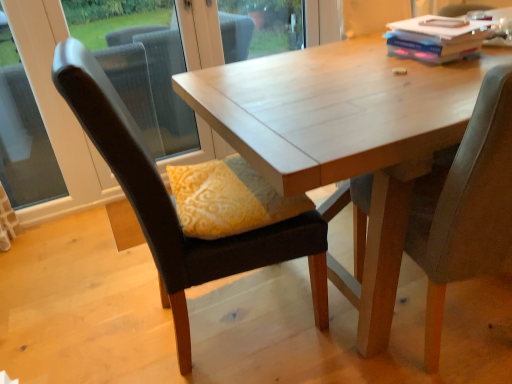
This screenshot has width=512, height=384. What do you see at coordinates (436, 38) in the screenshot? I see `hardcover book at upper right` at bounding box center [436, 38].

At what (x,y) coordinates should I click in order to perform the action: click on velvet dark brown chair at center, which appears as the second chair when viewed from the right. Please return your answer as a coordinate pair (x, y). The width and height of the screenshot is (512, 384). Looking at the image, I should click on (172, 204).

Measure the distance between yellow fabric pillow at center and camera.

A distance of 3.89 feet exists between yellow fabric pillow at center and camera.

What do you see at coordinates (114, 87) in the screenshot?
I see `white plastic window frame at upper left` at bounding box center [114, 87].

Image resolution: width=512 pixels, height=384 pixels. Find the location of `white plastic window frame at upper left`. white plastic window frame at upper left is located at coordinates (114, 87).

What is the approximate width of velvet grey chair at right, which ranks as the second chair in left-to-right order?

It is 23.10 inches.

At what (x,y) coordinates should I click in order to perform the action: click on hardcover book at upper right. Please return your answer as a coordinate pair (x, y). The height and width of the screenshot is (384, 512). Looking at the image, I should click on (436, 38).

From a real-world perspective, between white plastic window frame at upper left and velvet dark brown chair at center, placed as the 1th chair when sorted from left to right, who is vertically lower?

From a 3D spatial view, velvet dark brown chair at center, placed as the 1th chair when sorted from left to right, is below.

From the image's perspective, between white plastic window frame at upper left and velvet dark brown chair at center, which appears as the second chair when viewed from the right, which one is located above?

white plastic window frame at upper left appears higher in the image.

How different are the orientations of white plastic window frame at upper left and velvet dark brown chair at center, placed as the 1th chair when sorted from left to right, in degrees?

The facing directions of white plastic window frame at upper left and velvet dark brown chair at center, placed as the 1th chair when sorted from left to right, are 84.6 degrees apart.

Is white plastic window frame at upper left smaller than velvet dark brown chair at center, which appears as the second chair when viewed from the right?

Yes, white plastic window frame at upper left is smaller than velvet dark brown chair at center, which appears as the second chair when viewed from the right.

Would you say yellow fabric pillow at center is a long distance from transparent glass window at left?

Indeed, yellow fabric pillow at center is not near transparent glass window at left.

From the picture: Considering the relative sizes of yellow fabric pillow at center and transparent glass window at left in the image provided, is yellow fabric pillow at center smaller than transparent glass window at left?

Actually, yellow fabric pillow at center might be larger than transparent glass window at left.

Which of these two, hardcover book at upper right or yellow fabric pillow at center, stands taller?

yellow fabric pillow at center is taller.

Which is closer to the camera, (405, 39) or (287, 204)?

Point (405, 39) is farther from the camera than point (287, 204).

From the image's perspective, does hardcover book at upper right appear higher than yellow fabric pillow at center?

Yes.

From a real-world perspective, is hardcover book at upper right positioned above or below yellow fabric pillow at center?

From a real-world perspective, hardcover book at upper right is physically above yellow fabric pillow at center.

Which is behind, point (438, 51) or point (441, 73)?

The point (438, 51) is farther.

Which is in front, hardcover book at upper right or wooden table at center?

wooden table at center is in front.

Between hardcover book at upper right and wooden table at center, which one has smaller size?

With smaller size is hardcover book at upper right.

Can we say hardcover book at upper right lies outside wooden table at center?

No, hardcover book at upper right is inside wooden table at center's boundary.

Consider the image. Is transparent glass window at left outside of wooden table at center?

Yes, transparent glass window at left is outside of wooden table at center.

From the image's perspective, is transparent glass window at left located above wooden table at center?

Yes, from the image's perspective, transparent glass window at left is on top of wooden table at center.

Is transparent glass window at left far away from wooden table at center?

Indeed, transparent glass window at left is not near wooden table at center.

From a real-world perspective, is transparent glass window at left positioned over wooden table at center based on gravity?

Yes.

Is white plastic window frame at upper left inside yellow fabric pillow at center?

That's incorrect, white plastic window frame at upper left is not inside yellow fabric pillow at center.

From a real-world perspective, is yellow fabric pillow at center above or below white plastic window frame at upper left?

From a real-world perspective, yellow fabric pillow at center is physically below white plastic window frame at upper left.

Is yellow fabric pillow at center taller than white plastic window frame at upper left?

No.

Between transparent glass window at left and velvet grey chair at right, which ranks as the second chair in left-to-right order, which one appears on the right side from the viewer's perspective?

Positioned to the right is velvet grey chair at right, which ranks as the second chair in left-to-right order.

Is transparent glass window at left positioned behind velvet grey chair at right, the first chair from the right?

Yes, the depth of transparent glass window at left is greater than that of velvet grey chair at right, the first chair from the right.

From the image's perspective, which one is positioned higher, transparent glass window at left or velvet grey chair at right, which ranks as the second chair in left-to-right order?

transparent glass window at left.

What are the coordinates of `window behind the velvet grey chair at right, which ranks as the second chair in left-to-right order` in the screenshot? It's located at (23, 134).

Image resolution: width=512 pixels, height=384 pixels. I want to click on chair that is the 1st object to the right of the white plastic window frame at upper left, starting at the anchor, so click(x=172, y=204).

The width and height of the screenshot is (512, 384). Identify the location of pillow in front of the transparent glass window at left. (228, 199).

Which object lies further to the anchor point wooden table at center, yellow fabric pillow at center or velvet grey chair at right, the first chair from the right?

Based on the image, yellow fabric pillow at center appears to be further to wooden table at center.

When comparing their distances from velvet grey chair at right, the first chair from the right, does white plastic window frame at upper left or velvet dark brown chair at center, placed as the 1th chair when sorted from left to right, seem closer?

velvet dark brown chair at center, placed as the 1th chair when sorted from left to right.

When comparing their distances from transparent glass window at left, does white plastic window frame at upper left or wooden table at center seem further?

Based on the image, wooden table at center appears to be further to transparent glass window at left.

Considering their positions, is transparent glass window at left positioned closer to hardcover book at upper right than yellow fabric pillow at center?

yellow fabric pillow at center is positioned closer to the anchor hardcover book at upper right.

Estimate the real-world distances between objects in this image. Which object is closer to wooden table at center, velvet grey chair at right, which ranks as the second chair in left-to-right order, or hardcover book at upper right?

velvet grey chair at right, which ranks as the second chair in left-to-right order, is closer to wooden table at center.

Estimate the real-world distances between objects in this image. Which object is further from yellow fabric pillow at center, white plastic window frame at upper left or transparent glass window at left?

transparent glass window at left lies further to yellow fabric pillow at center than the other object.

Which object lies nearer to the anchor point yellow fabric pillow at center, wooden table at center or white plastic window frame at upper left?

wooden table at center.

Estimate the real-world distances between objects in this image. Which object is further from velvet dark brown chair at center, which appears as the second chair when viewed from the right, velvet grey chair at right, which ranks as the second chair in left-to-right order, or yellow fabric pillow at center?

velvet grey chair at right, which ranks as the second chair in left-to-right order, is positioned further to the anchor velvet dark brown chair at center, which appears as the second chair when viewed from the right.

At what (x,y) coordinates should I click in order to perform the action: click on book between velvet dark brown chair at center, placed as the 1th chair when sorted from left to right, and white plastic window frame at upper left from front to back. Please return your answer as a coordinate pair (x, y). Looking at the image, I should click on (436, 38).

At what (x,y) coordinates should I click in order to perform the action: click on window frame between transparent glass window at left and velvet grey chair at right, the first chair from the right, from left to right. Please return your answer as a coordinate pair (x, y). Image resolution: width=512 pixels, height=384 pixels. Looking at the image, I should click on (114, 87).

This screenshot has height=384, width=512. What are the coordinates of `book situated between yellow fabric pillow at center and wooden table at center from left to right` in the screenshot? It's located at (436, 38).

Where is `pillow located between velvet dark brown chair at center, placed as the 1th chair when sorted from left to right, and white plastic window frame at upper left in the depth direction`? This screenshot has width=512, height=384. pillow located between velvet dark brown chair at center, placed as the 1th chair when sorted from left to right, and white plastic window frame at upper left in the depth direction is located at coordinates (228, 199).